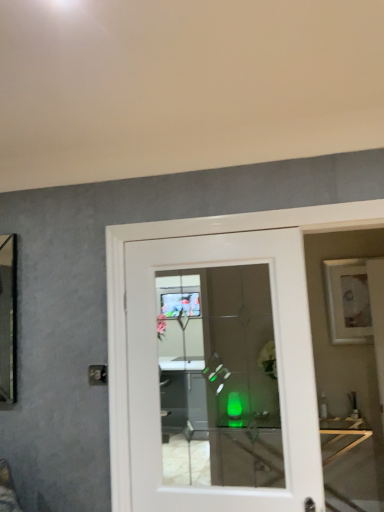
Question: Is translucent glass table at center taller or shorter than white glossy door at center?

Choices:
 (A) tall
 (B) short

Answer: (B)

Question: Relative to white glossy door at center, is translucent glass table at center in front or behind?

Choices:
 (A) front
 (B) behind

Answer: (B)

Question: Considering the real-world distances, which object is closest to the white matte picture frame at upper right?

Choices:
 (A) white glossy door at center
 (B) translucent glass table at center

Answer: (B)

Question: Estimate the real-world distances between objects in this image. Which object is farther from the translucent glass table at center?

Choices:
 (A) white glossy door at center
 (B) white matte picture frame at upper right

Answer: (A)